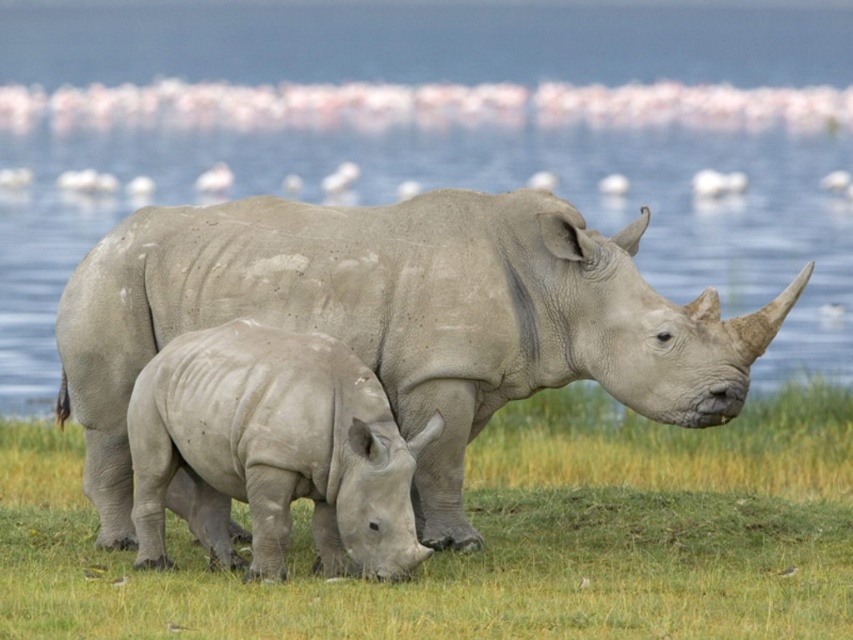
Question: Does clear blue water at center appear on the left side of matte gray rhinoceros at center?

Choices:
 (A) no
 (B) yes

Answer: (A)

Question: Which object is farther from the camera taking this photo?

Choices:
 (A) clear blue water at center
 (B) smooth gray rhino at center

Answer: (A)

Question: Considering the relative positions of clear blue water at center and matte gray rhinoceros at center in the image provided, where is clear blue water at center located with respect to matte gray rhinoceros at center?

Choices:
 (A) below
 (B) above

Answer: (B)

Question: Is clear blue water at center closer to the viewer compared to smooth gray rhino at center?

Choices:
 (A) yes
 (B) no

Answer: (B)

Question: Which object is closer to the camera taking this photo?

Choices:
 (A) smooth gray rhino at center
 (B) clear blue water at center
 (C) matte gray rhinoceros at center

Answer: (A)

Question: Estimate the real-world distances between objects in this image. Which object is closer to the smooth gray rhino at center?

Choices:
 (A) matte gray rhinoceros at center
 (B) clear blue water at center
 (C) green grass at center

Answer: (A)